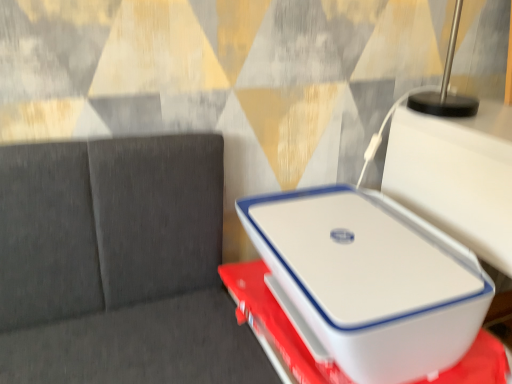
Question: Are white plastic laptop at center and white plastic container at center beside each other?

Choices:
 (A) no
 (B) yes

Answer: (A)

Question: Considering the relative sizes of white plastic laptop at center and white plastic container at center in the image provided, is white plastic laptop at center bigger than white plastic container at center?

Choices:
 (A) yes
 (B) no

Answer: (A)

Question: Would you say white plastic container at center is part of white plastic laptop at center's contents?

Choices:
 (A) no
 (B) yes

Answer: (A)

Question: From the image's perspective, would you say white plastic laptop at center is shown under white plastic container at center?

Choices:
 (A) yes
 (B) no

Answer: (B)

Question: From the image's perspective, is white plastic laptop at center on white plastic container at center?

Choices:
 (A) yes
 (B) no

Answer: (A)

Question: Considering the relative sizes of white plastic laptop at center and white plastic container at center in the image provided, is white plastic laptop at center taller than white plastic container at center?

Choices:
 (A) yes
 (B) no

Answer: (A)

Question: Is white plastic container at center bigger than white plastic laptop at center?

Choices:
 (A) yes
 (B) no

Answer: (B)

Question: Considering the relative sizes of white plastic container at center and white plastic laptop at center in the image provided, is white plastic container at center wider than white plastic laptop at center?

Choices:
 (A) yes
 (B) no

Answer: (A)

Question: Is the surface of white plastic container at center in direct contact with white plastic laptop at center?

Choices:
 (A) no
 (B) yes

Answer: (A)

Question: Is white plastic container at center to the right of white plastic laptop at center from the viewer's perspective?

Choices:
 (A) yes
 (B) no

Answer: (A)

Question: Does white plastic container at center come in front of white plastic laptop at center?

Choices:
 (A) yes
 (B) no

Answer: (A)

Question: Is white plastic container at center aimed at white plastic laptop at center?

Choices:
 (A) no
 (B) yes

Answer: (A)

Question: From a real-world perspective, is white plastic container at center physically located above or below white plastic laptop at center?

Choices:
 (A) below
 (B) above

Answer: (A)